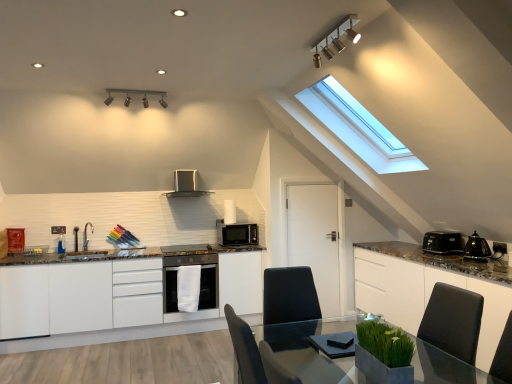
Question: Is black plastic toaster at right, which is the 1th appliance from back to front, in front of or behind white glossy cabinet at right, which ranks as the second cabinetry in left-to-right order, in the image?

Choices:
 (A) behind
 (B) front

Answer: (A)

Question: Is black plastic toaster at right, the 2th appliance in the front-to-back sequence, taller or shorter than white glossy cabinet at right, which ranks as the second cabinetry in left-to-right order?

Choices:
 (A) tall
 (B) short

Answer: (B)

Question: Which is nearer to the matte black microwave at center, which is the 2th kitchen appliance from top to bottom?

Choices:
 (A) black plastic toaster at right, which is the 1th appliance from back to front
 (B) clear glass table at center
 (C) white glossy cabinet at right, the 1th cabinetry in the right-to-left sequence
 (D) black matte oven at center
 (E) metallic track lights at upper center, which is the 2th light fixture from left to right

Answer: (D)

Question: Which is farther from the satin silver range hood at upper center, which is the 1th kitchen appliance from left to right?

Choices:
 (A) matte black microwave at center, arranged as the first kitchen appliance when ordered from the bottom
 (B) metallic track lights at upper center, acting as the first light fixture starting from the front
 (C) black plastic toaster at right, which is the 1th appliance from back to front
 (D) white glossy cabinets at center, placed as the 2th cabinetry when sorted from right to left
 (E) clear glass table at center

Answer: (E)